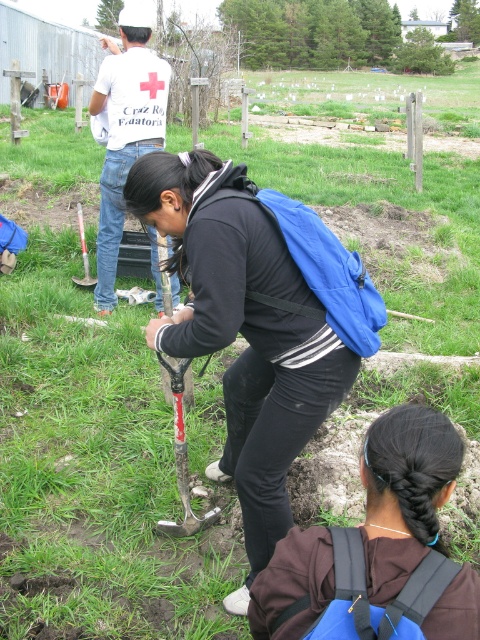
Between blue fabric backpack at center and red plastic shovel at center, which one is positioned higher?

red plastic shovel at center is higher up.

Between blue fabric backpack at center and red plastic shovel at center, which one has less height?

red plastic shovel at center

Is point (282, 323) less distant than point (84, 244)?

That is True.

You are a GUI agent. You are given a task and a screenshot of the screen. Output one action in this format:
    pyautogui.click(x=<x>, y=<y>)
    Task: Click on the blue fabric backpack at center
    
    Given the screenshot: What is the action you would take?
    pyautogui.click(x=243, y=330)

Which of these two, blue fabric backpack at center or rusty metal shovel at center, stands taller?

With more height is blue fabric backpack at center.

Is blue fabric backpack at center thinner than rusty metal shovel at center?

Incorrect, blue fabric backpack at center's width is not less than rusty metal shovel at center's.

This screenshot has height=640, width=480. What do you see at coordinates (243, 330) in the screenshot?
I see `blue fabric backpack at center` at bounding box center [243, 330].

Where is `blue fabric backpack at center`? This screenshot has height=640, width=480. blue fabric backpack at center is located at coordinates (243, 330).

Can you confirm if blue backpack at lower center is wider than white cotton shirt at upper center?

In fact, blue backpack at lower center might be narrower than white cotton shirt at upper center.

Does blue backpack at lower center appear on the left side of white cotton shirt at upper center?

In fact, blue backpack at lower center is to the right of white cotton shirt at upper center.

Image resolution: width=480 pixels, height=640 pixels. What are the coordinates of `blue backpack at lower center` in the screenshot? It's located at (377, 548).